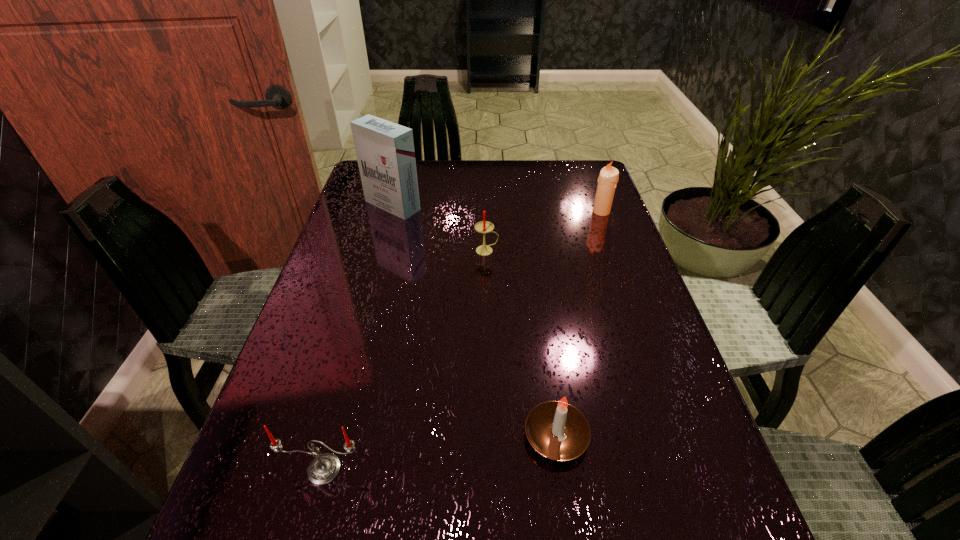
Locate an element on the screen. The image size is (960, 540). the tallest object is located at coordinates (385, 152).

Where is `the second tallest object`? The width and height of the screenshot is (960, 540). the second tallest object is located at coordinates (608, 178).

I want to click on the tallest candle, so (608, 178).

What are the coordinates of `the leftmost candle` in the screenshot? It's located at (324, 468).

Where is `the second farthest candle`? The image size is (960, 540). the second farthest candle is located at coordinates (484, 226).

The height and width of the screenshot is (540, 960). Identify the location of the third object from right to left. (484, 226).

You are a GUI agent. You are given a task and a screenshot of the screen. Output one action in this format:
    pyautogui.click(x=<x>, y=<y>)
    Task: Click on the second candle from right to left
    The width and height of the screenshot is (960, 540).
    Given the screenshot: What is the action you would take?
    point(558,431)

I want to click on vacant space positioned 0.360m on the front of the tallest object, so click(364, 312).

Where is `vacant space located on the front of the farthest candle`? vacant space located on the front of the farthest candle is located at coordinates (607, 227).

At what (x,y) coordinates should I click in order to perform the action: click on vacant region located on the front-facing side of the leftmost candle. Please return your answer as a coordinate pair (x, y). Looking at the image, I should click on (311, 519).